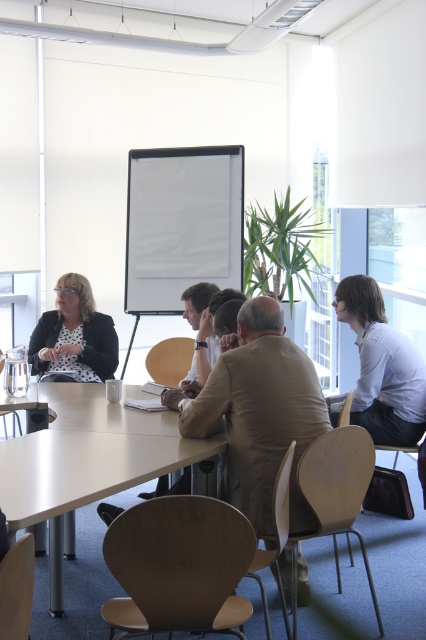
You are sitting at the table in the meeting room and want to reach the white matte projection screen at center and the matte black blazer at left. Which object is closer to you?

The white matte projection screen at center is closer to you because it is further to the viewer than the matte black blazer at left, meaning it is positioned nearer in the scene.

You are standing at the center of the meeting room facing the table. There are two points marked on the floor at coordinates point (239, 273) and point (46, 355). If you want to walk from your current position to the point that is further away from the table, which coordinate should you head towards?

Point (239, 273) is behind point (46, 355), so you should head towards point (239, 273) as it is further away from the table.

You are standing in the meeting room and want to determine which of the two points, point (282, 396) or point (380, 376), is closer to you. Based on the scene description, which point is nearer?

Point (282, 396) is closer to the viewer than point (380, 376).